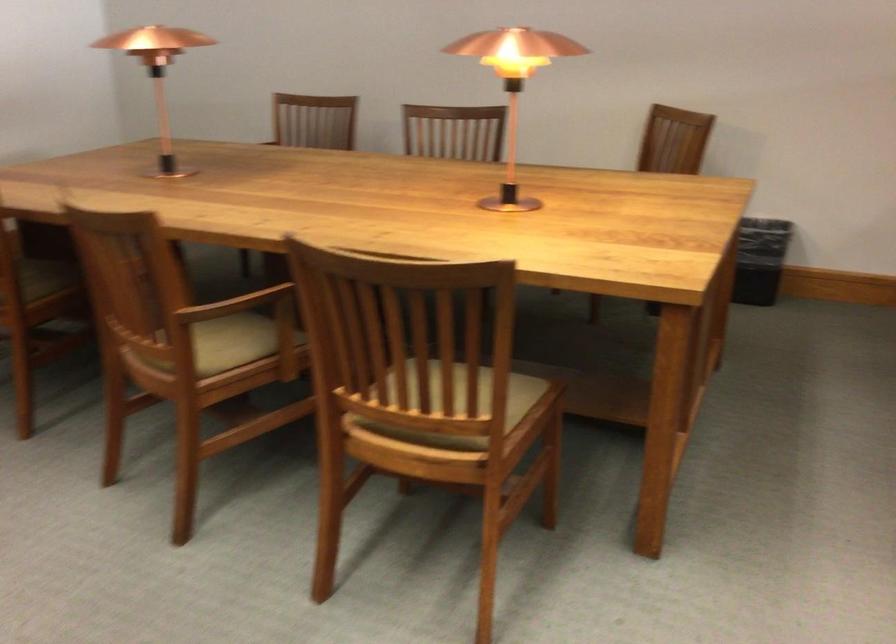
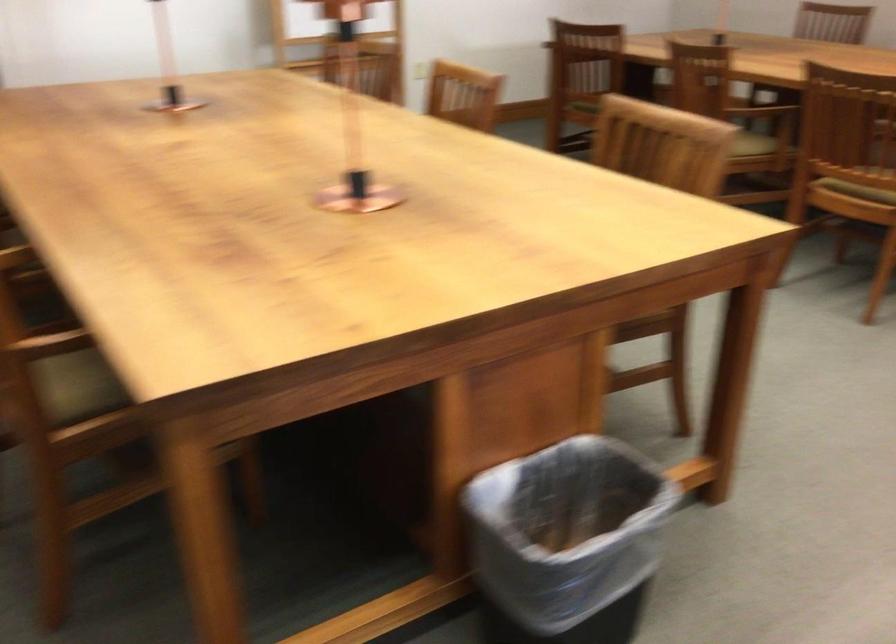
In the second image, find the point that corresponds to point 419,477 in the first image.

(857, 191)